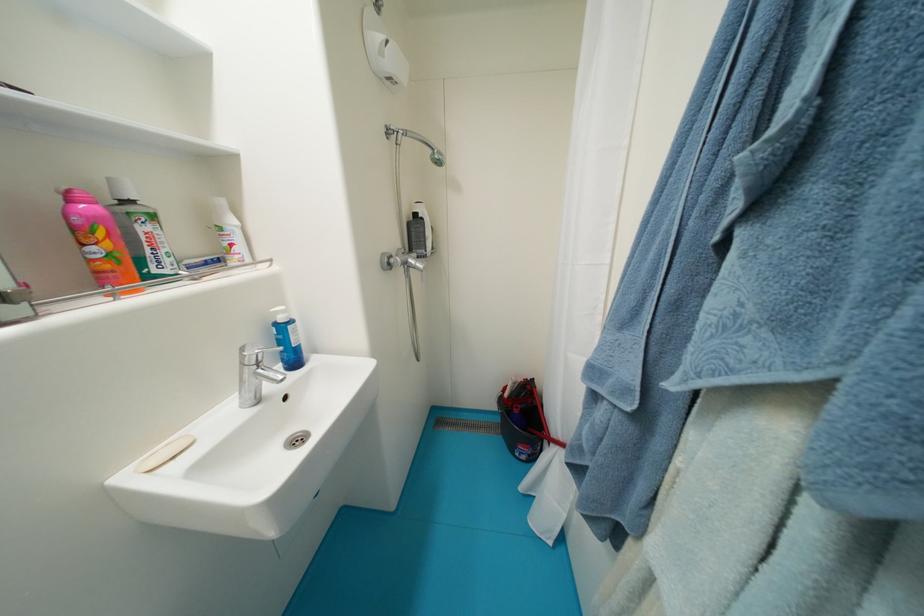
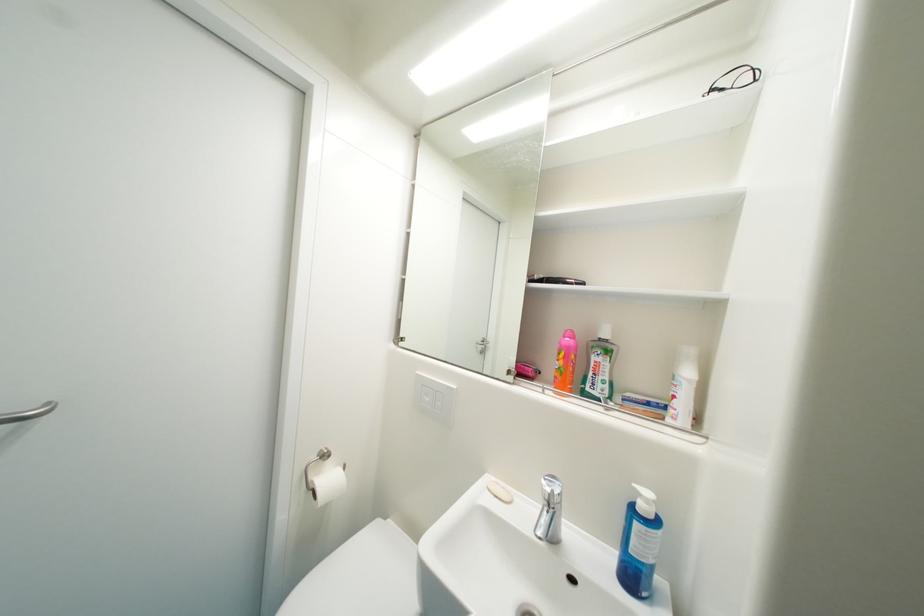
Find the pixel in the second image that matches pixel 154 252 in the first image.

(598, 376)